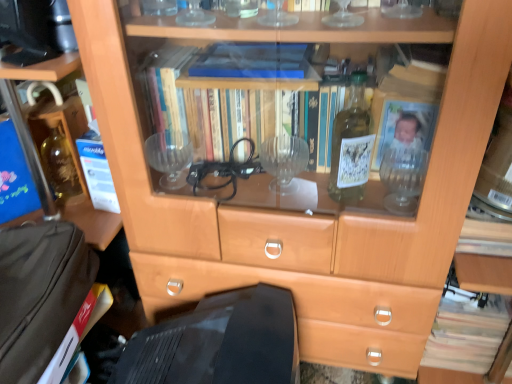
Question: In the image, is light brown paper book at lower right positioned in front of or behind brown paper at left, which is the second paperback book in top-to-bottom order?

Choices:
 (A) front
 (B) behind

Answer: (B)

Question: From the image's perspective, relative to brown paper at left, placed as the first paperback book when sorted from bottom to top, is light brown paper book at lower right above or below?

Choices:
 (A) below
 (B) above

Answer: (A)

Question: Which of these objects is positioned farthest from the light brown paper book at lower right?

Choices:
 (A) black glossy computer monitor at lower center
 (B) white paper at left, which is the 1th paperback book in top-to-bottom order
 (C) brown fabric suitcase at lower left
 (D) brown paper at left, placed as the first paperback book when sorted from bottom to top

Answer: (B)

Question: Estimate the real-world distances between objects in this image. Which object is farther from the black glossy computer monitor at lower center?

Choices:
 (A) brown fabric suitcase at lower left
 (B) light brown paper book at lower right
 (C) brown paper at left, placed as the first paperback book when sorted from bottom to top
 (D) white paper at left, which is the 1th paperback book in top-to-bottom order

Answer: (B)